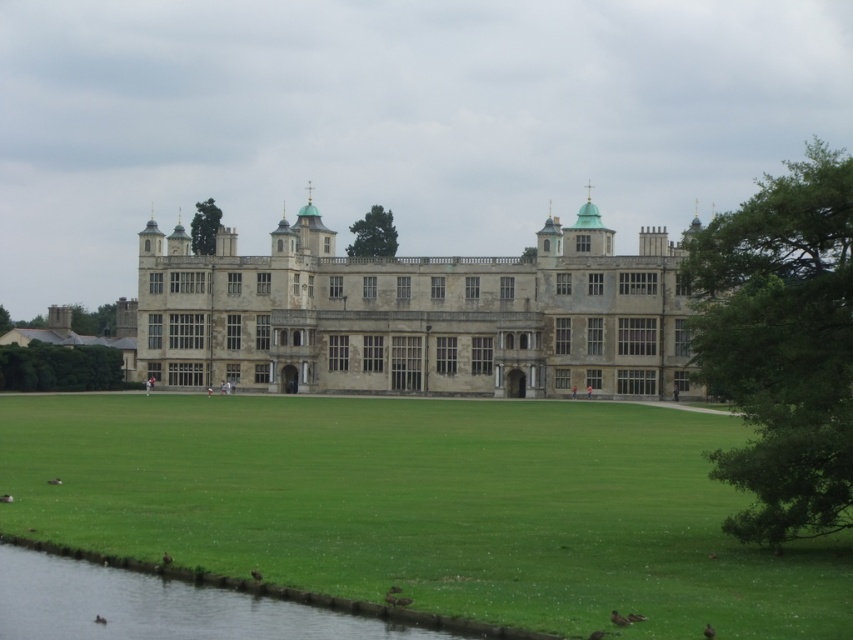
Who is taller, green grass at center or green grassy river at lower left?

green grass at center

Between green grass at center and green grassy river at lower left, which one appears on the left side from the viewer's perspective?

Answer: green grassy river at lower left

Between point (339, 490) and point (54, 584), which one is positioned in front?

Point (54, 584)

You are a GUI agent. You are given a task and a screenshot of the screen. Output one action in this format:
    pyautogui.click(x=<x>, y=<y>)
    Task: Click on the green grass at center
    
    Given the screenshot: What is the action you would take?
    click(x=425, y=506)